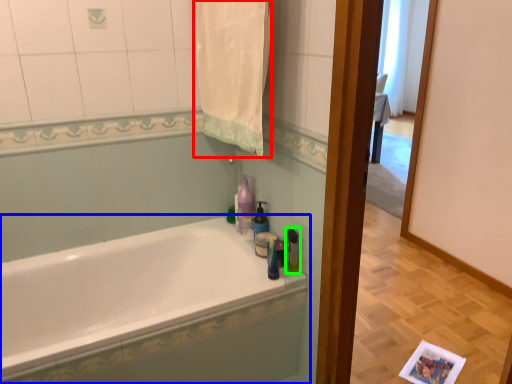
Question: Which object is the farthest from bath towel (highlighted by a red box)? Choose among these: bathtub (highlighted by a blue box) or toiletry (highlighted by a green box).

Choices:
 (A) bathtub
 (B) toiletry

Answer: (A)